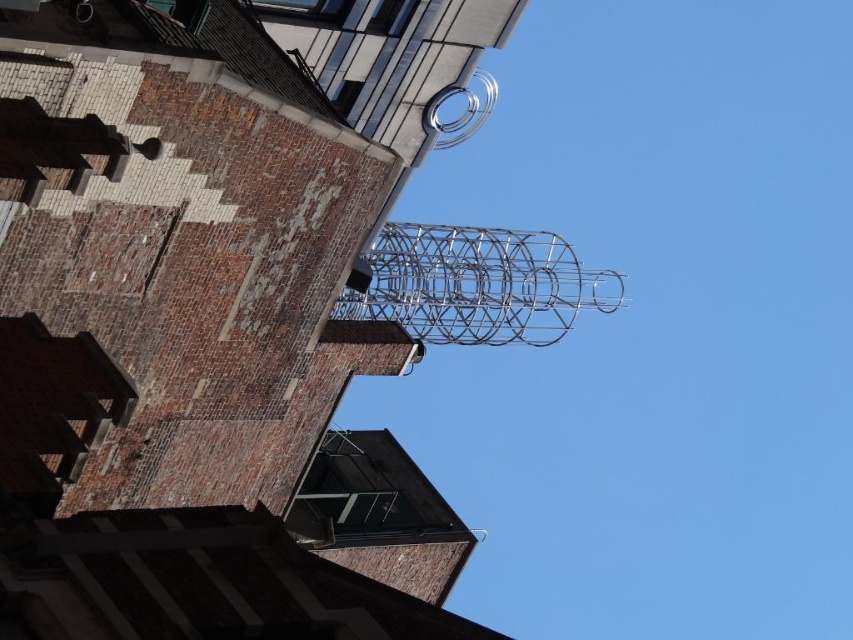
Who is lower down, silver metallic tower at upper center or silver metallic wire at upper center?

silver metallic tower at upper center is below.

Can you confirm if silver metallic tower at upper center is smaller than silver metallic wire at upper center?

Yes, silver metallic tower at upper center is smaller than silver metallic wire at upper center.

Which is behind, point (370, 561) or point (480, 291)?

Positioned behind is point (480, 291).

The width and height of the screenshot is (853, 640). I want to click on silver metallic tower at upper center, so click(x=192, y=342).